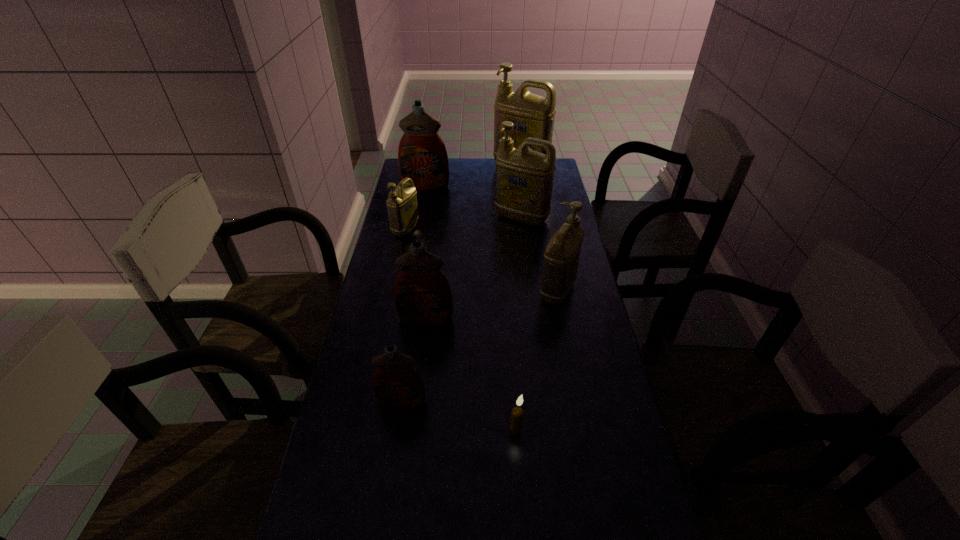
Image resolution: width=960 pixels, height=540 pixels. What are the coordinates of `red detergent that stands as the second closest to the third biggest beige detergent` in the screenshot? It's located at (397, 385).

At what (x,y) coordinates should I click in order to perform the action: click on vacant space that satisfies the following two spatial constraints: 1. on the front surface of the second farthest red detergent; 2. on the left side of the cream candle. Please return your answer as a coordinate pair (x, y). Image resolution: width=960 pixels, height=540 pixels. Looking at the image, I should click on (412, 428).

This screenshot has width=960, height=540. In order to click on vacant space that satisfies the following two spatial constraints: 1. on the front surface of the third biggest beige detergent; 2. on the left side of the farthest red detergent in this screenshot , I will do `click(407, 291)`.